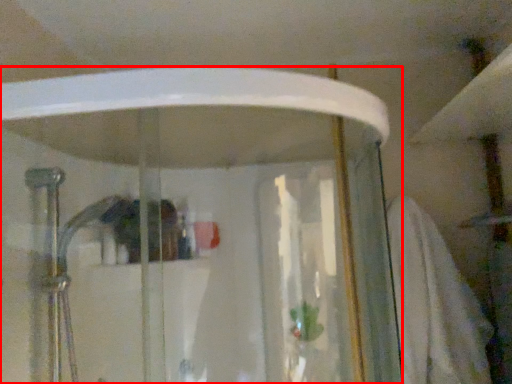
Question: Considering the relative positions of shower door (annotated by the red box) and bath towel in the image provided, where is shower door (annotated by the red box) located with respect to the staircase?

Choices:
 (A) left
 (B) right

Answer: (A)